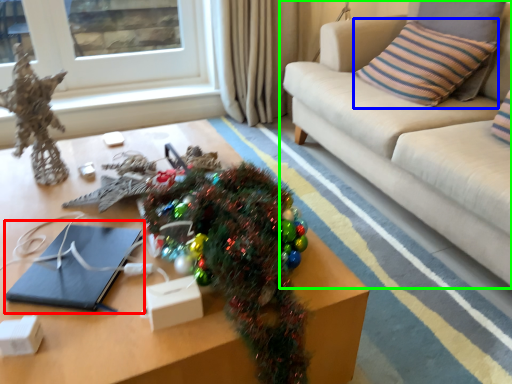
Question: Which is nearer to the notebook (highlighted by a red box)? pillow (highlighted by a blue box) or studio couch (highlighted by a green box).

Choices:
 (A) pillow
 (B) studio couch

Answer: (B)